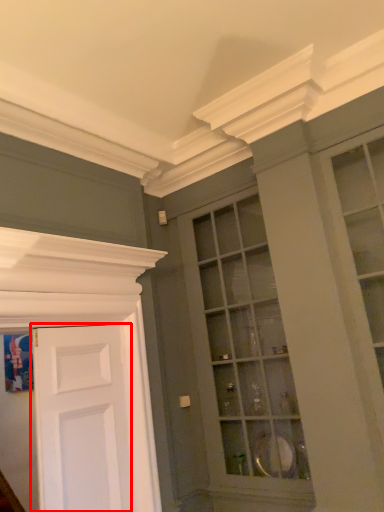
Question: Observing the image, what is the correct spatial positioning of door (annotated by the red box) in reference to window?

Choices:
 (A) left
 (B) right

Answer: (A)